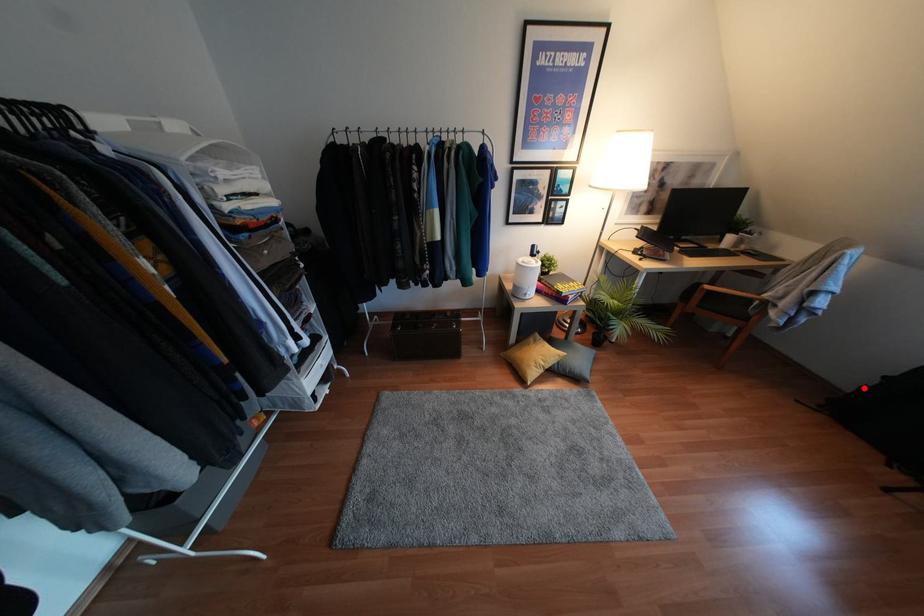
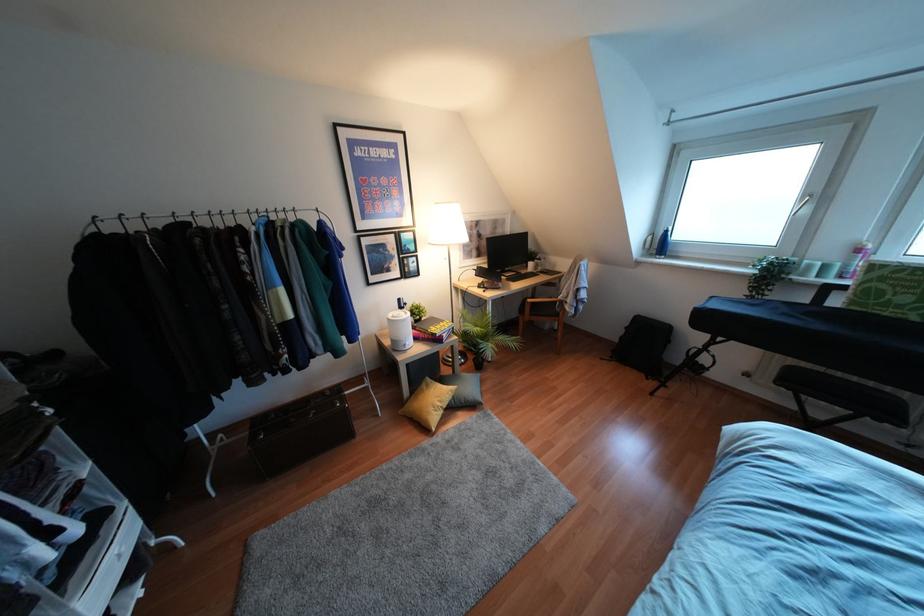
Question: I am providing you with two images of the same scene from different viewpoints. Given a red point in image1, look at the same physical point in image2. Is it:

Choices:
 (A) Closer to the viewpoint
 (B) Farther from the viewpoint

Answer: (A)